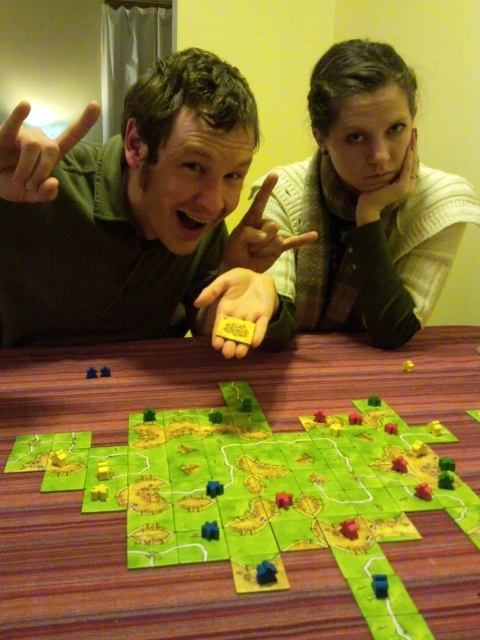
Question: Does matte yellow token at center appear over green paper map at center?

Choices:
 (A) yes
 (B) no

Answer: (A)

Question: Which point is closer to the camera?

Choices:
 (A) green paper map at center
 (B) matte yellow token at center

Answer: (A)

Question: Among these objects, which one is farthest from the camera?

Choices:
 (A) matte yellow token at center
 (B) green paper map at center

Answer: (A)

Question: Can you confirm if matte yellow token at center is positioned to the left of green paper map at center?

Choices:
 (A) no
 (B) yes

Answer: (B)

Question: Is matte yellow token at center bigger than green paper map at center?

Choices:
 (A) yes
 (B) no

Answer: (A)